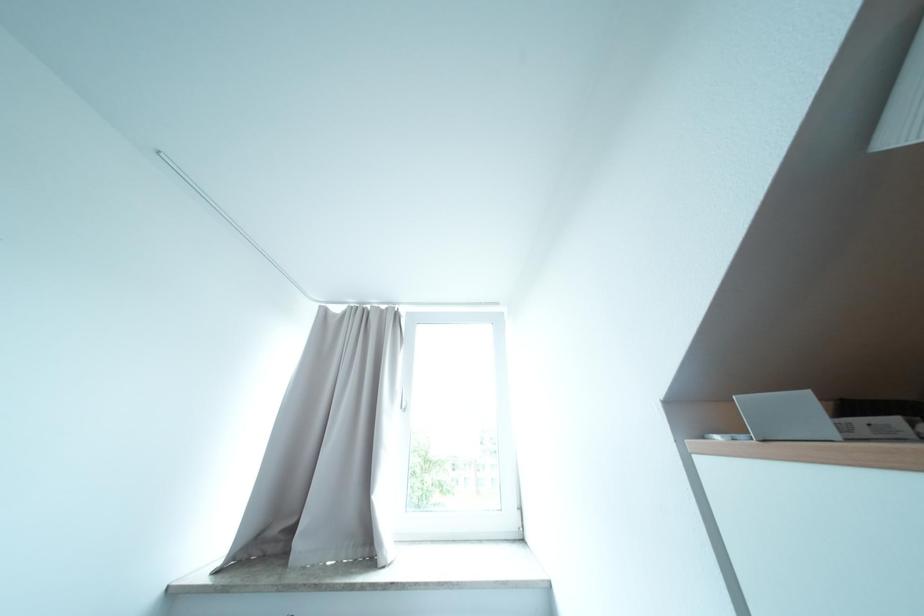
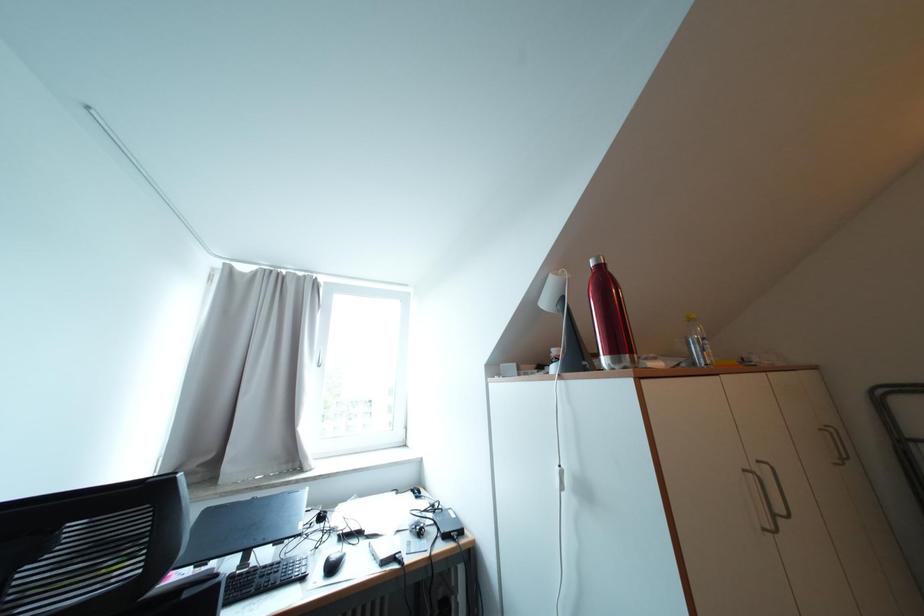
Which direction would the cameraman need to move to produce the second image?

The cameraman moved toward left, backward.